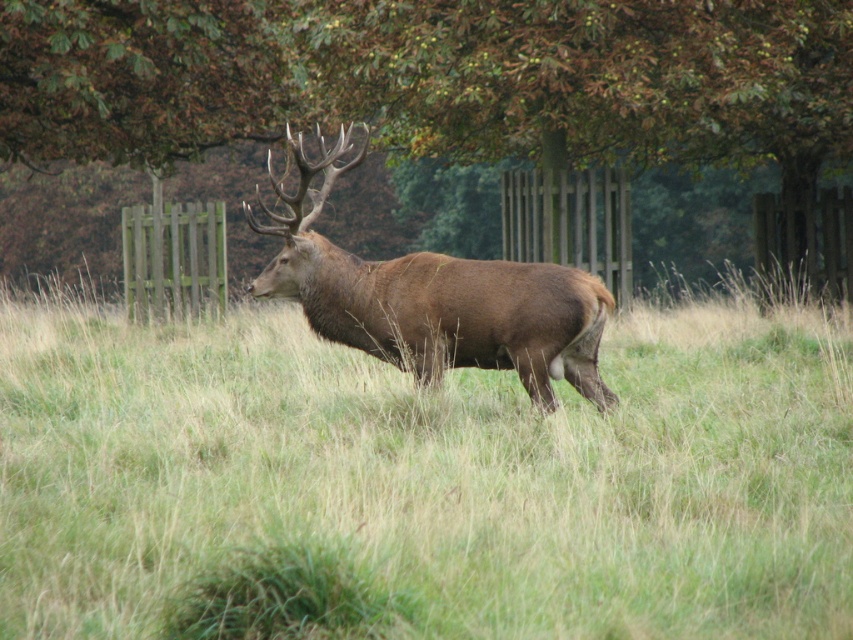
You are a hiker who wants to take a photo of the brown velvet deer at center. To get a clear shot, you need to ensure the green leafy tree at upper center isn not blocking the deer. Is the tree positioned to the left or right of the deer?

The green leafy tree at upper center is positioned on the left side of brown velvet deer at center, so it is to the left of the deer and may block the shot depending on your angle.

In the scene shown: You are a photographer trying to capture the brown velvet deer at center in your shot. However, you notice the brown matte grass at center might be blocking your view. Based on the scene, can you determine if the grass is in front of or behind the deer?

The brown matte grass at center is closer to the viewer than the brown velvet deer at center, so the grass is in front of the deer and may block the view.